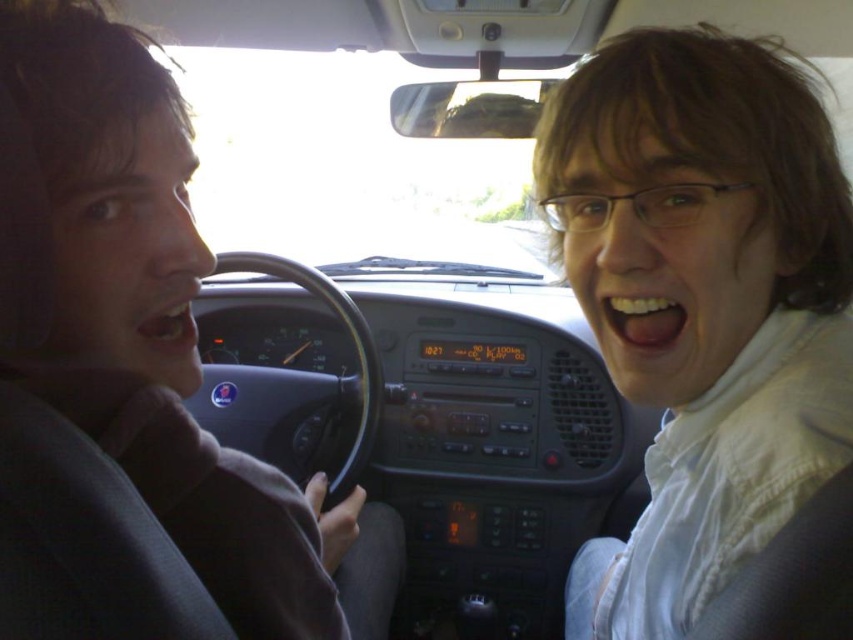
Which is in front, point (641, 179) or point (51, 337)?

Point (51, 337)

Which of these two, white matte jacket at center or matte gray shirt at left, stands taller?

With more height is white matte jacket at center.

At what (x,y) coordinates should I click in order to perform the action: click on white matte jacket at center. Please return your answer as a coordinate pair (x, y). Looking at the image, I should click on (701, 301).